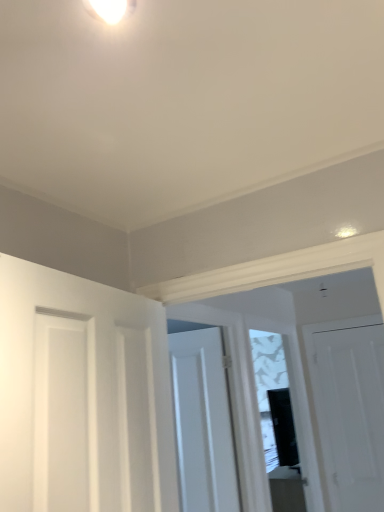
Question: Does transparent glass window at center have a larger size compared to white matte door at right, the third door in the front-to-back sequence?

Choices:
 (A) yes
 (B) no

Answer: (A)

Question: Is transparent glass window at center next to white matte door at right, the 3th door from the left, and touching it?

Choices:
 (A) yes
 (B) no

Answer: (B)

Question: Considering the relative sizes of transparent glass window at center and white matte door at right, placed as the first door when sorted from right to left, in the image provided, is transparent glass window at center shorter than white matte door at right, placed as the first door when sorted from right to left,?

Choices:
 (A) no
 (B) yes

Answer: (A)

Question: From the image's perspective, would you say transparent glass window at center is shown under white matte door at right, the 3th door from the left?

Choices:
 (A) no
 (B) yes

Answer: (A)

Question: From the image's perspective, is transparent glass window at center on top of white matte door at right, arranged as the first door when viewed from the back?

Choices:
 (A) no
 (B) yes

Answer: (B)

Question: Based on their positions, is white matte door at center, the 2th door viewed from the left, located to the left or right of white glossy light fixture at upper center?

Choices:
 (A) left
 (B) right

Answer: (B)

Question: In terms of width, does white matte door at center, arranged as the 2th door when viewed from the front, look wider or thinner when compared to white glossy light fixture at upper center?

Choices:
 (A) wide
 (B) thin

Answer: (B)

Question: From their relative heights in the image, would you say white matte door at center, which is counted as the second door, starting from the right, is taller or shorter than white glossy light fixture at upper center?

Choices:
 (A) short
 (B) tall

Answer: (B)

Question: From the image's perspective, is white matte door at center, arranged as the 2th door when viewed from the front, positioned above or below white glossy light fixture at upper center?

Choices:
 (A) below
 (B) above

Answer: (A)

Question: Relative to white matte door at left, acting as the first door starting from the front, is white glossy light fixture at upper center in front or behind?

Choices:
 (A) front
 (B) behind

Answer: (B)

Question: Is white glossy light fixture at upper center wider or thinner than white matte door at left, arranged as the 3th door when viewed from the right?

Choices:
 (A) wide
 (B) thin

Answer: (B)

Question: Is white glossy light fixture at upper center bigger or smaller than white matte door at left, the 1th door when ordered from left to right?

Choices:
 (A) big
 (B) small

Answer: (B)

Question: From a real-world perspective, is white glossy light fixture at upper center physically located above or below white matte door at left, arranged as the 3th door when viewed from the right?

Choices:
 (A) below
 (B) above

Answer: (B)

Question: From the image's perspective, is white glossy light fixture at upper center positioned above or below white matte door at center, the 2th door viewed from the left?

Choices:
 (A) above
 (B) below

Answer: (A)

Question: Looking at the image, does white glossy light fixture at upper center seem bigger or smaller compared to white matte door at center, which is counted as the second door, starting from the right?

Choices:
 (A) big
 (B) small

Answer: (B)